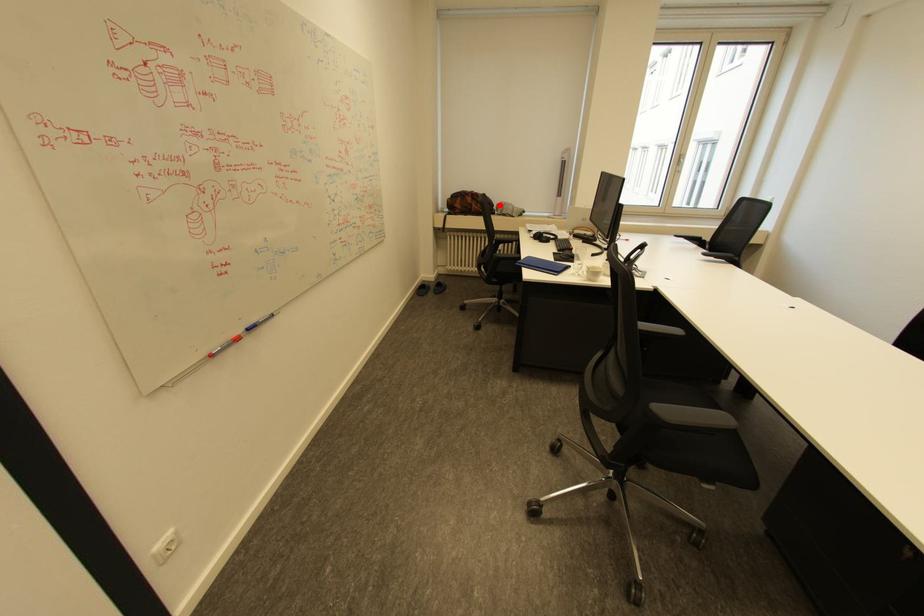
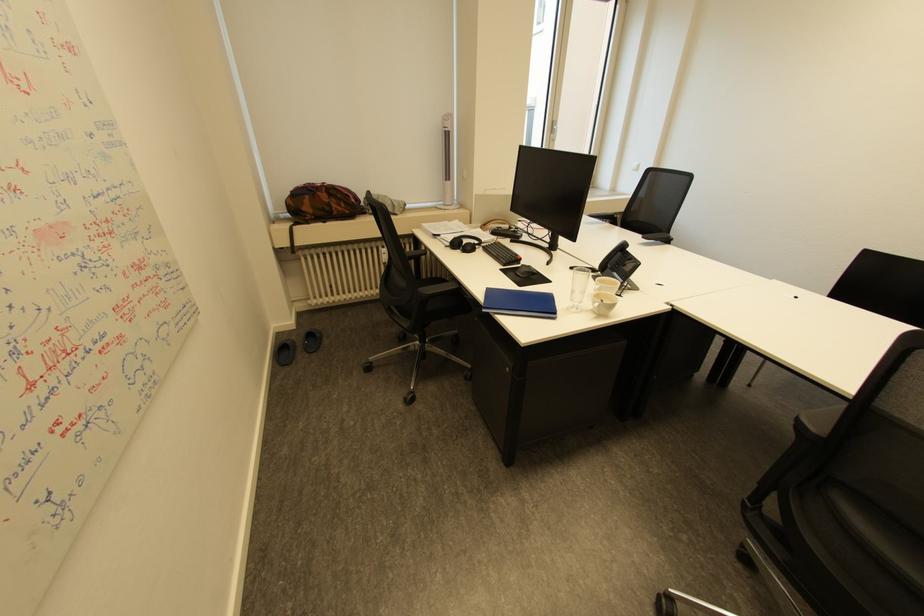
Find the pixel in the second image that matches the highlighted location in the first image.

(367, 200)